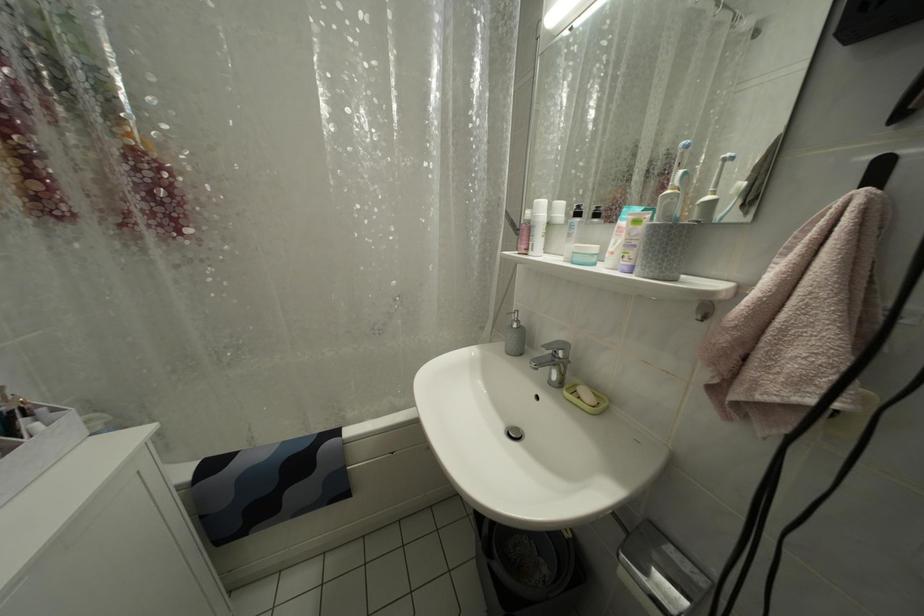
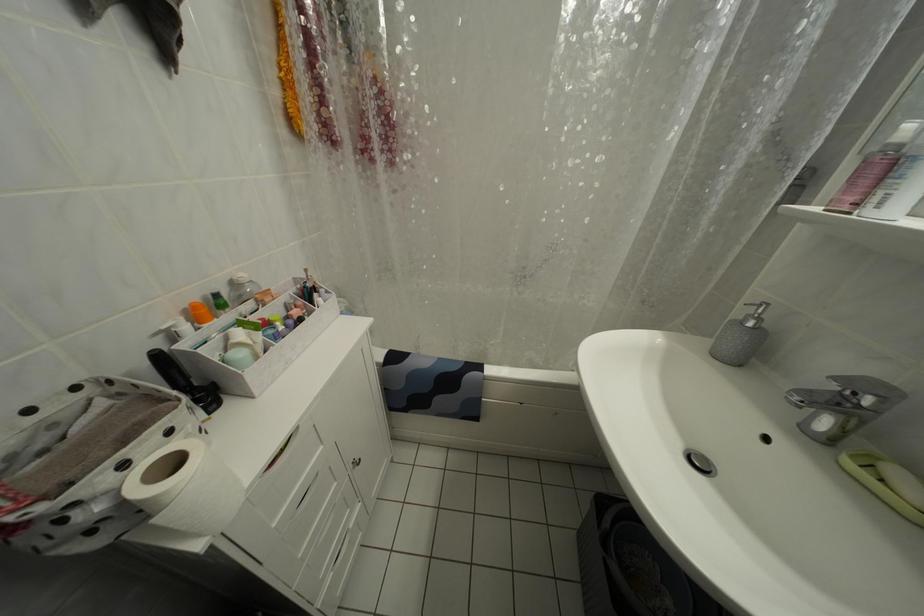
Question: The first image is from the beginning of the video and the second image is from the end. How did the camera likely rotate when shooting the video?

Choices:
 (A) Left
 (B) Right
 (C) Up
 (D) Down

Answer: (A)